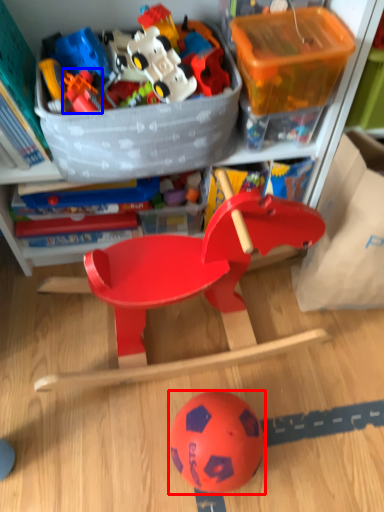
Question: Which point is further to the camera, ball (highlighted by a red box) or toy (highlighted by a blue box)?

Choices:
 (A) ball
 (B) toy

Answer: (B)